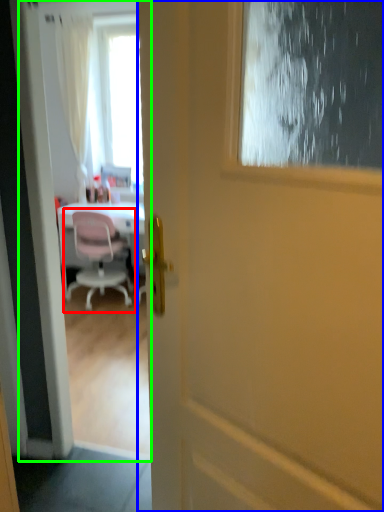
Question: Estimate the real-world distances between objects in this image. Which object is closer to chair (highlighted by a red box), door (highlighted by a blue box) or screen door (highlighted by a green box)?

Choices:
 (A) door
 (B) screen door

Answer: (B)